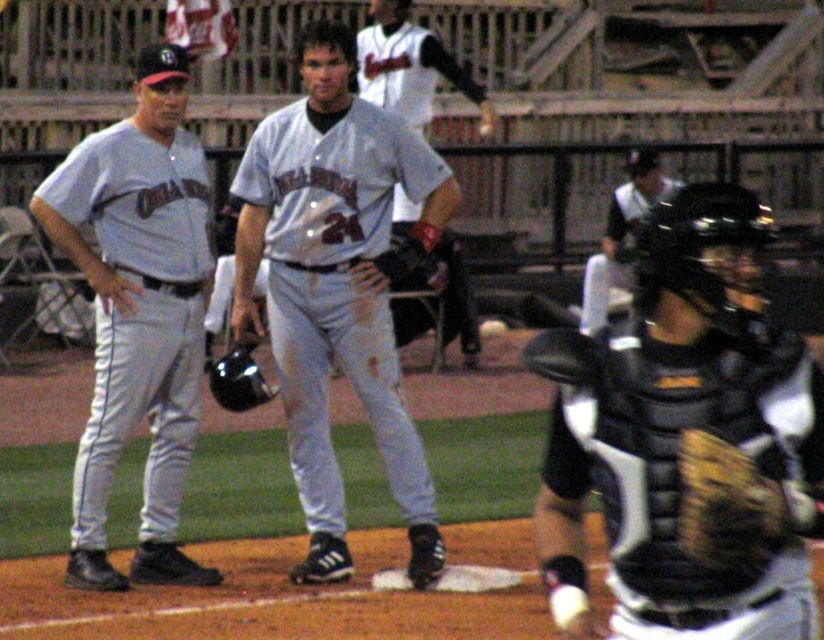
Question: Does gray matte uniform at center lie in front of gray fabric uniform at left?

Choices:
 (A) no
 (B) yes

Answer: (A)

Question: Can you confirm if gray matte uniform at center is positioned to the left of black leather glove at center?

Choices:
 (A) no
 (B) yes

Answer: (B)

Question: Which object appears farthest from the camera in this image?

Choices:
 (A) black padded chest protector at lower right
 (B) white matte baseball at center
 (C) gray matte uniform at center

Answer: (B)

Question: Is gray matte uniform at center bigger than white matte baseball at center?

Choices:
 (A) yes
 (B) no

Answer: (A)

Question: Which point is farther to the camera?

Choices:
 (A) pyautogui.click(x=733, y=449)
 (B) pyautogui.click(x=640, y=170)

Answer: (B)

Question: Among these points, which one is farthest from the camera?

Choices:
 (A) (624, 259)
 (B) (152, 524)
 (C) (684, 436)
 (D) (485, 125)

Answer: (A)